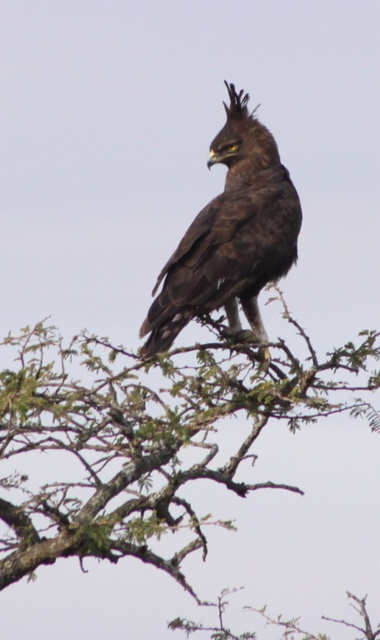
Question: Which of the following is the farthest from the observer?

Choices:
 (A) dark brown feathers at center
 (B) green leafy branch at upper center

Answer: (A)

Question: Is green leafy branch at upper center further to camera compared to dark brown feathers at center?

Choices:
 (A) no
 (B) yes

Answer: (A)

Question: Does green leafy branch at upper center appear under dark brown feathers at center?

Choices:
 (A) no
 (B) yes

Answer: (B)

Question: Is green leafy branch at upper center positioned behind dark brown feathers at center?

Choices:
 (A) no
 (B) yes

Answer: (A)

Question: Among these objects, which one is farthest from the camera?

Choices:
 (A) green leafy branch at upper center
 (B) dark brown feathers at center

Answer: (B)

Question: Which object appears farthest from the camera in this image?

Choices:
 (A) dark brown feathers at center
 (B) green leafy branch at upper center

Answer: (A)